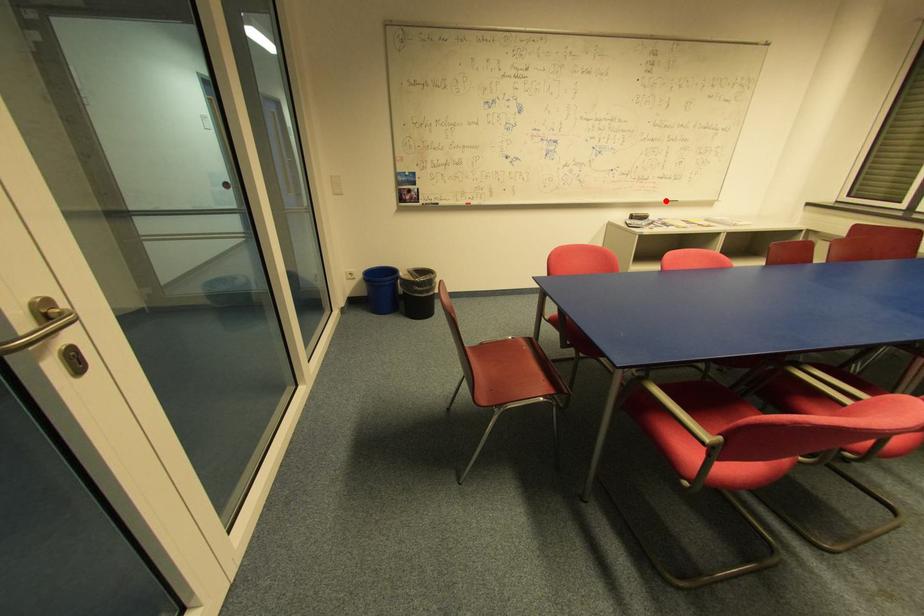
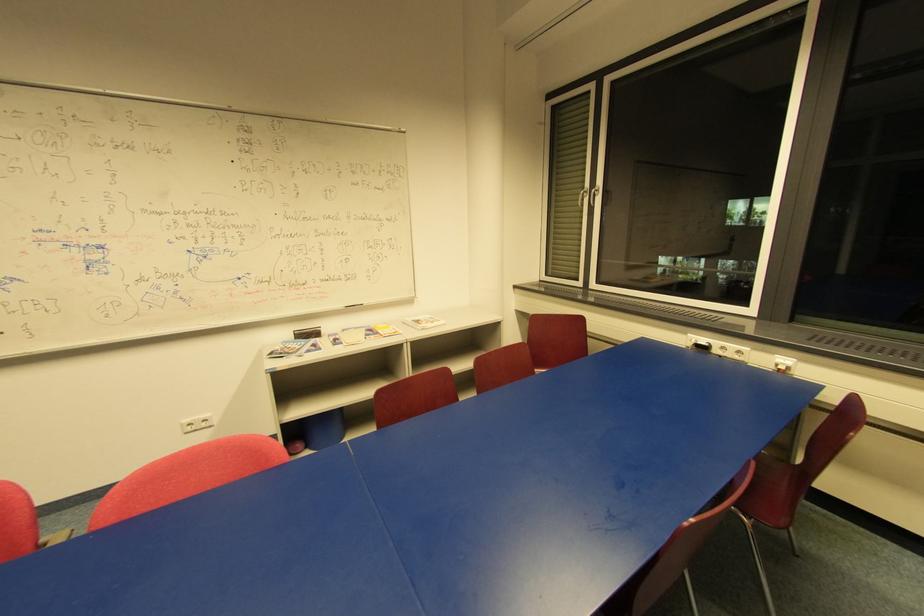
Where in the second image is the point corresponding to the highlighted location from the first image?

(344, 307)